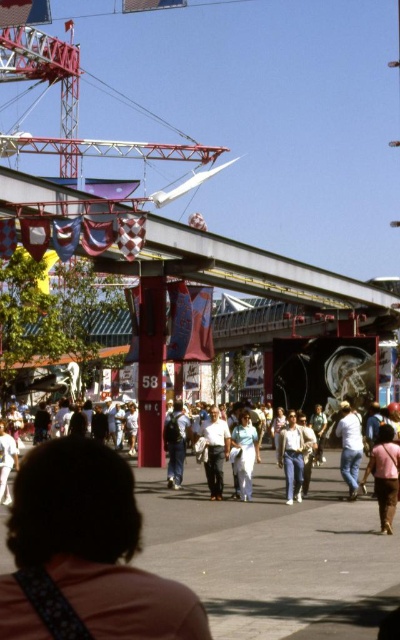
You are standing at the camera position and want to take a photo of the pink fabric shirt at lower center. Is the shirt within the camera range of 40 meters?

The pink fabric shirt at lower center and camera are 40.56 meters apart. The distance exceeds the camera range of 40 meters, so the shirt is out of range.

You are standing in the fairground and see the white cotton shirt at center and the light blue fabric pants at center. Which one is closer to you?

The white cotton shirt at center is closer to you because it is further to the viewer than the light blue fabric pants at center.

Consider the image. You are standing at the fairground and want to take a photo of the point at coordinates (x=248, y=493). The camera you have can focus on objects up to 100 meters away. Will the point be in focus?

The point at coordinates (x=248, y=493) is 93.59 meters away from the camera, which is within the camera focus range of up to 100 meters. Therefore, the point will be in focus.